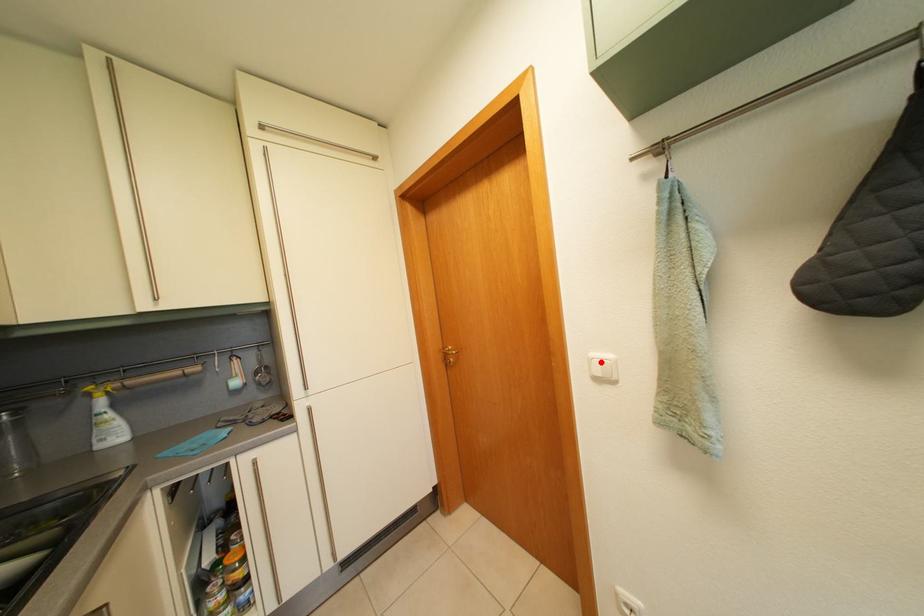
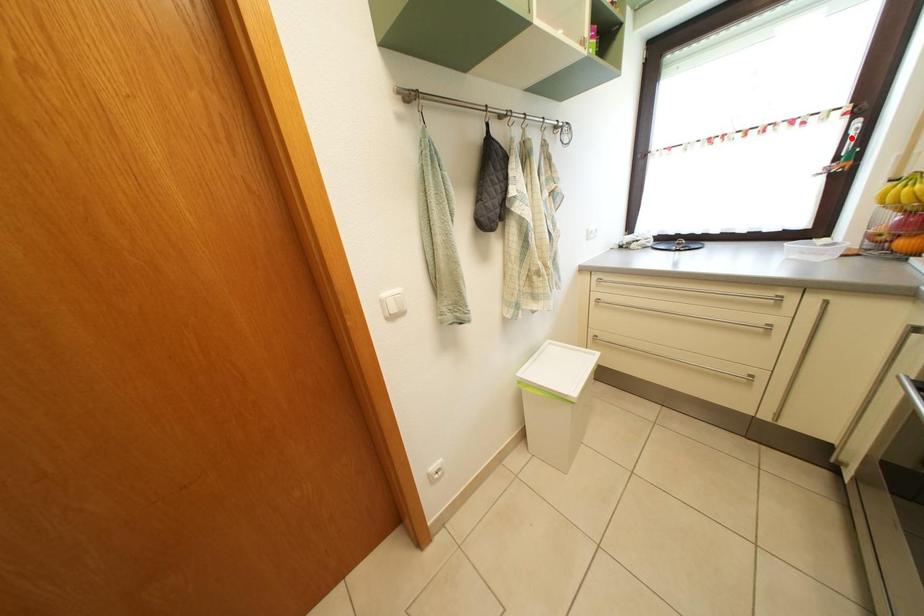
I am providing you with two images of the same scene from different viewpoints. A red point is marked on the first image and another point is marked on the second image. Is the red point in image1 aligned with the point shown in image2?

No